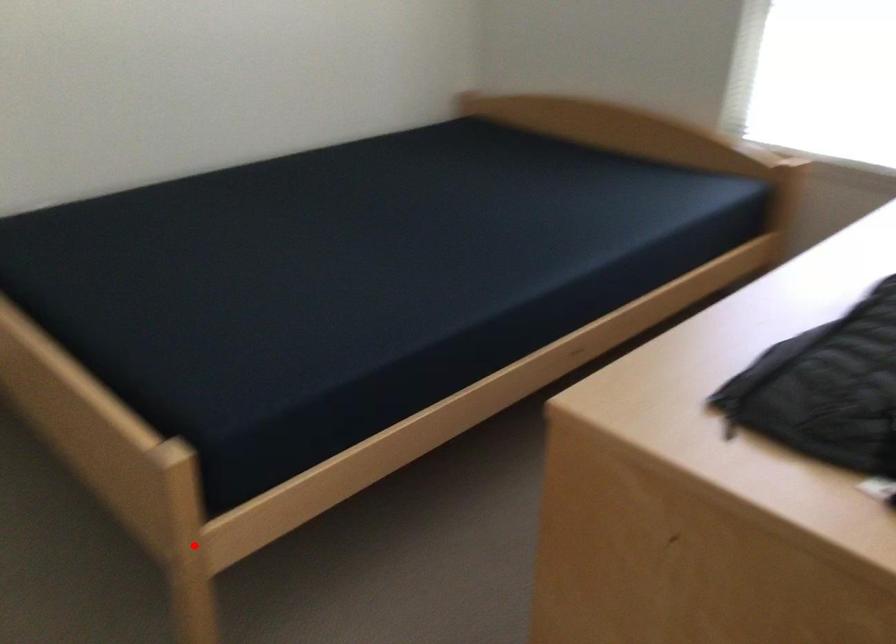
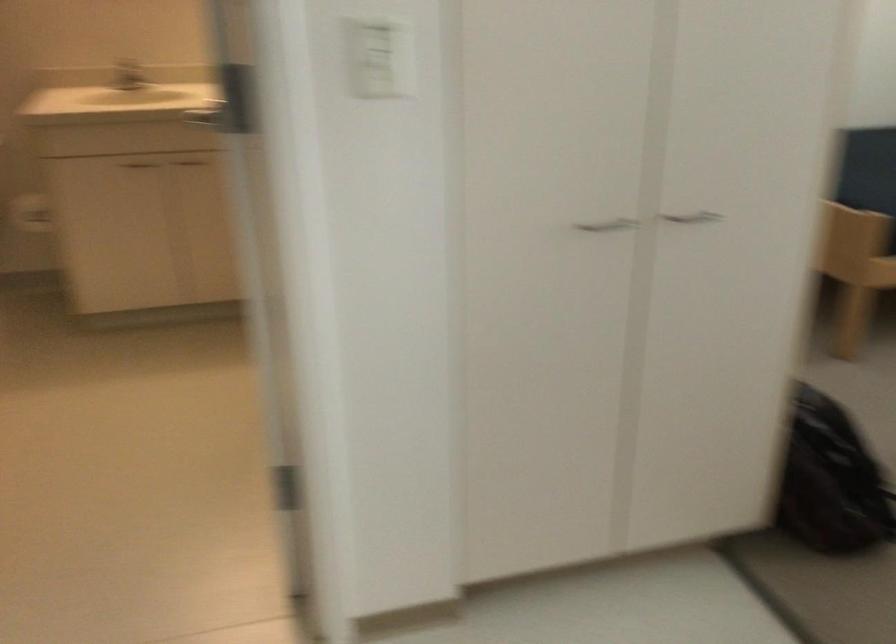
Question: I am providing you with two images of the same scene from different viewpoints. Image1 has a red point marked. In image2, the corresponding 3D location appears at what relative position? Reply with the corresponding letter.

Choices:
 (A) Closer
 (B) Farther

Answer: (B)